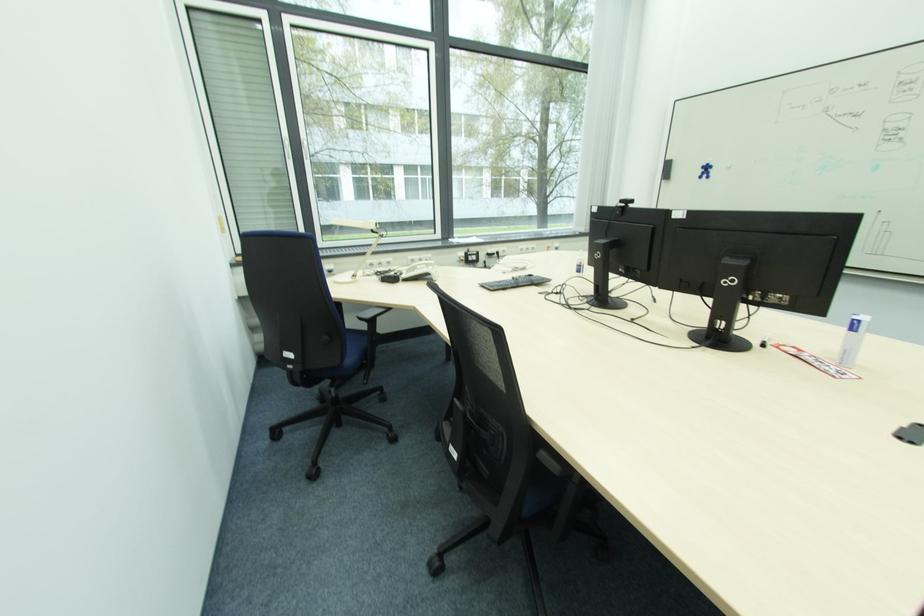
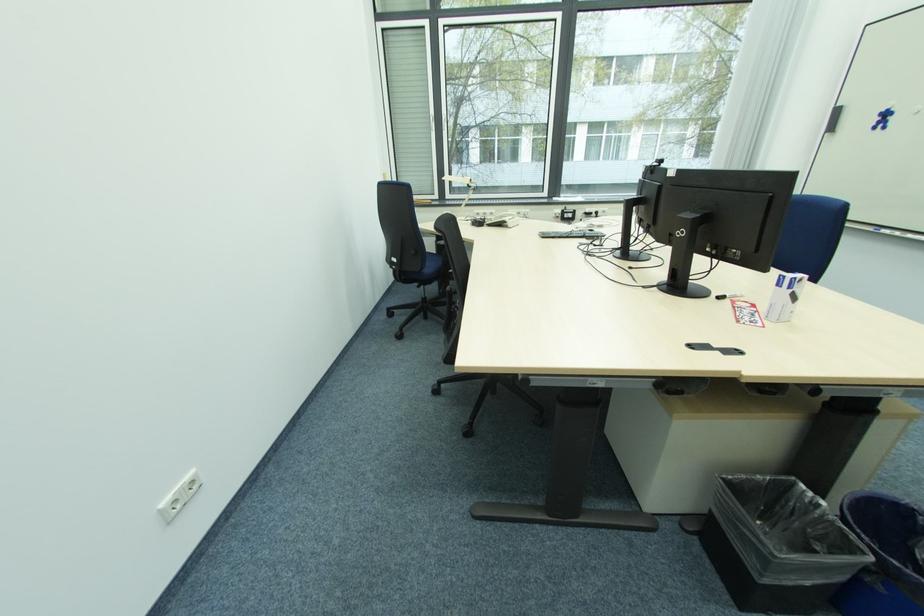
In the second image, find the point that corresponds to point (392, 265) in the first image.

(494, 216)